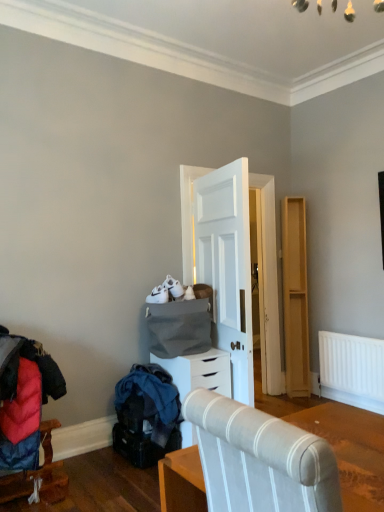
Question: Should I look upward or downward to see velvet red coat at lower left, the 2th furniture when ordered from right to left?

Choices:
 (A) up
 (B) down

Answer: (B)

Question: From a real-world perspective, does white matte chest of drawers at center sit lower than textured fabric chair at center, placed as the 1th furniture when sorted from top to bottom?

Choices:
 (A) yes
 (B) no

Answer: (A)

Question: Considering the relative sizes of white matte chest of drawers at center and textured fabric chair at center, acting as the second furniture starting from the bottom, in the image provided, is white matte chest of drawers at center wider than textured fabric chair at center, acting as the second furniture starting from the bottom,?

Choices:
 (A) no
 (B) yes

Answer: (A)

Question: Can textured fabric chair at center, placed as the 1th furniture when sorted from top to bottom, be found inside white matte chest of drawers at center?

Choices:
 (A) no
 (B) yes

Answer: (A)

Question: Are white matte chest of drawers at center and textured fabric chair at center, which is the 2th furniture in left-to-right order, located far from each other?

Choices:
 (A) yes
 (B) no

Answer: (A)

Question: Is white matte chest of drawers at center further to the viewer compared to textured fabric chair at center, acting as the second furniture starting from the bottom?

Choices:
 (A) no
 (B) yes

Answer: (B)

Question: From the image's perspective, does white matte chest of drawers at center appear lower than textured fabric chair at center, the second furniture from the back?

Choices:
 (A) no
 (B) yes

Answer: (B)

Question: Does textured fabric chair at center, positioned as the first furniture in front-to-back order, have a greater width compared to white matte chest of drawers at center?

Choices:
 (A) yes
 (B) no

Answer: (A)

Question: Considering the relative sizes of textured fabric chair at center, positioned as the first furniture in front-to-back order, and white matte chest of drawers at center in the image provided, is textured fabric chair at center, positioned as the first furniture in front-to-back order, taller than white matte chest of drawers at center?

Choices:
 (A) no
 (B) yes

Answer: (A)

Question: Is textured fabric chair at center, which is the 2th furniture in left-to-right order, to the left of white matte chest of drawers at center from the viewer's perspective?

Choices:
 (A) yes
 (B) no

Answer: (B)

Question: Is textured fabric chair at center, acting as the first furniture starting from the right, at the right side of white matte chest of drawers at center?

Choices:
 (A) yes
 (B) no

Answer: (A)

Question: Can you confirm if textured fabric chair at center, positioned as the first furniture in front-to-back order, is thinner than white matte chest of drawers at center?

Choices:
 (A) no
 (B) yes

Answer: (A)

Question: Would you say textured fabric chair at center, placed as the 1th furniture when sorted from top to bottom, is outside white matte chest of drawers at center?

Choices:
 (A) no
 (B) yes

Answer: (B)

Question: Would you say velvet red coat at lower left, the 2th furniture when ordered from right to left, is part of light wood dresser at right's contents?

Choices:
 (A) no
 (B) yes

Answer: (A)